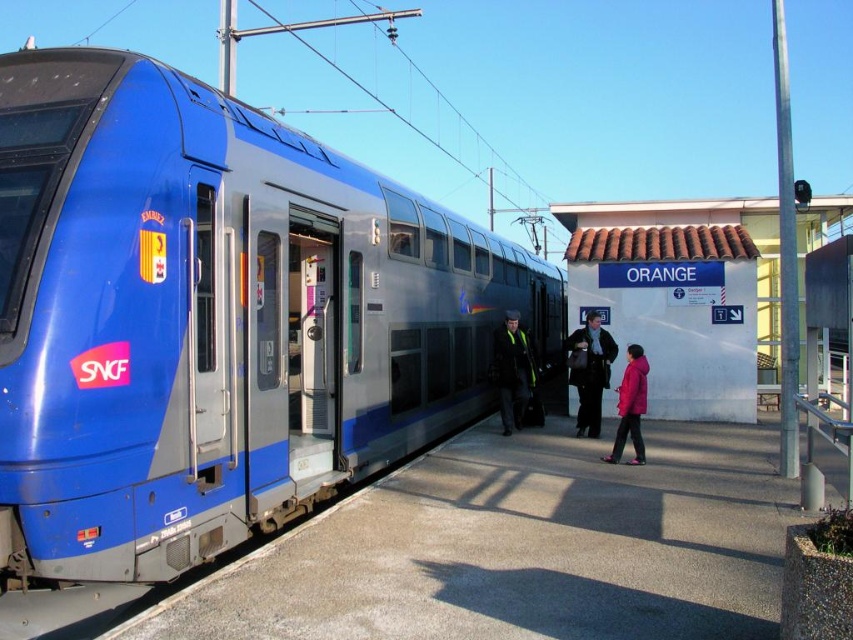
You are a photographer standing on the platform at the train station. You want to take a photo of the matte blue train at left and the pink matte jacket at center. Based on their sizes in the image, which object appears taller?

The matte blue train at left appears taller than the pink matte jacket at center because the matte blue train at left has a greater height compared to pink matte jacket at center.

Based on the photo, you are a photographer standing on the platform at the train station. You want to take a photo that includes both the matte blue train at left and the reflective yellow vest at center. Since you want both objects to be clearly visible in the frame, which object should you position closer to the camera to ensure both are in focus?

The reflective yellow vest at center is smaller than the matte blue train at left. To ensure both are in focus, position the reflective yellow vest at center closer to the camera since it is smaller and needs to be enlarged in the frame to match the size of the matte blue train at left.

You are standing at the train station platform and see the point marked at coordinates (589, 371). What object is located at that point?

The point at coordinates (589, 371) corresponds to the dark blue fabric coat at center.